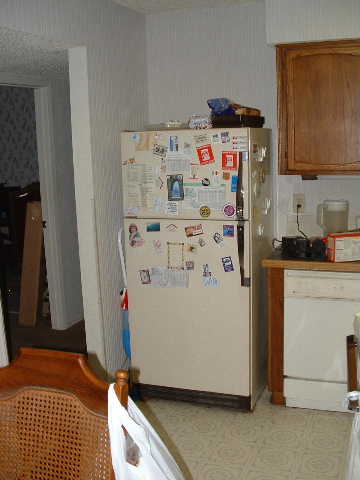
Image resolution: width=360 pixels, height=480 pixels. In order to click on dishwasher in this screenshot , I will do `click(319, 321)`.